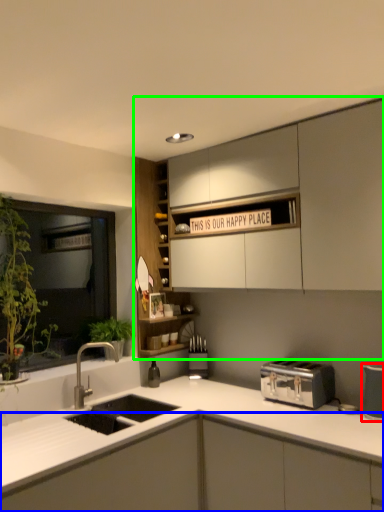
Question: Estimate the real-world distances between objects in this image. Which object is closer to appliance (highlighted by a red box), cabinetry (highlighted by a blue box) or cabinetry (highlighted by a green box)?

Choices:
 (A) cabinetry
 (B) cabinetry

Answer: (A)